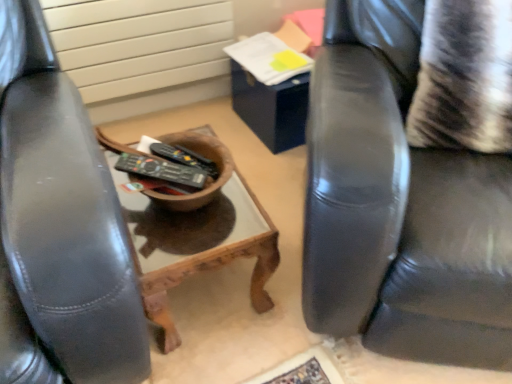
Question: From the image's perspective, is striped fabric pillow at right positioned above or below black plastic remote control at center, the 1th remote control in the back-to-front sequence?

Choices:
 (A) above
 (B) below

Answer: (A)

Question: Is striped fabric pillow at right inside or outside of black plastic remote control at center, the 1th remote control in the back-to-front sequence?

Choices:
 (A) outside
 (B) inside

Answer: (A)

Question: Estimate the real-world distances between objects in this image. Which object is closer to the black plastic remote control at center, the second remote control in the front-to-back sequence?

Choices:
 (A) white textured radiator at upper left
 (B) black plastic remote control at center, which ranks as the 2th remote control in back-to-front order
 (C) striped fabric pillow at right
 (D) woodenobject at center
 (E) black leather chair at right

Answer: (B)

Question: Based on their relative distances, which object is nearer to the striped fabric pillow at right?

Choices:
 (A) woodenobject at center
 (B) black plastic remote control at center, the 1th remote control in the back-to-front sequence
 (C) white textured radiator at upper left
 (D) black leather chair at right
 (E) black plastic remote control at center, which is the first remote control from front to back

Answer: (D)